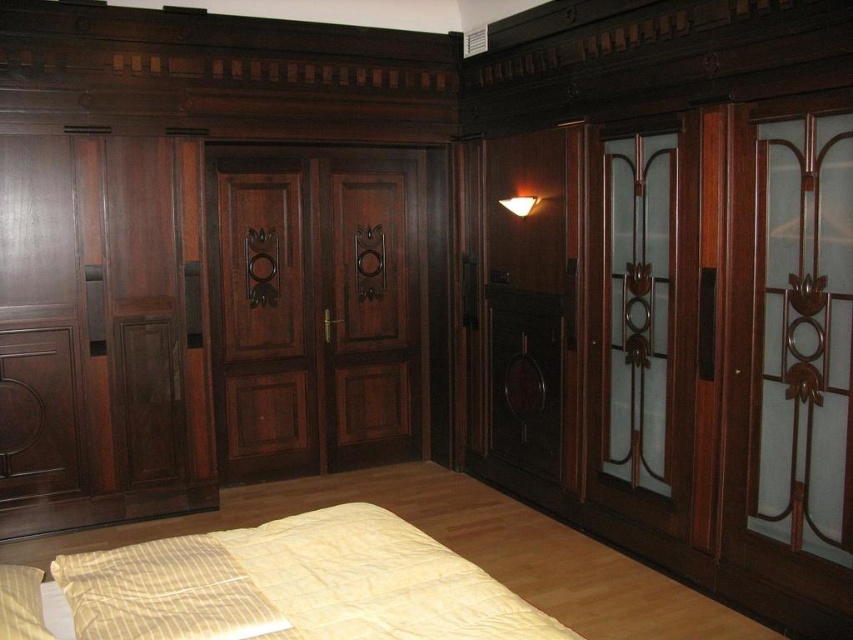
Question: Among these objects, which one is nearest to the camera?

Choices:
 (A) matte dark wood door at center
 (B) matte white wall sconce at upper center

Answer: (B)

Question: Based on their relative distances, which object is farther from the mahogany wood door at right?

Choices:
 (A) yellow fabric pillow at lower left
 (B) yellow striped fabric at lower center

Answer: (A)

Question: Does transparent glass door at right appear over matte white wall sconce at upper center?

Choices:
 (A) no
 (B) yes

Answer: (A)

Question: Does yellow striped fabric at lower center come in front of mahogany wood door at right?

Choices:
 (A) no
 (B) yes

Answer: (B)

Question: Is yellow striped fabric at lower center to the right of matte white wall sconce at upper center from the viewer's perspective?

Choices:
 (A) no
 (B) yes

Answer: (A)

Question: Which of these objects is positioned farthest from the yellow fabric pillow at lower left?

Choices:
 (A) yellow striped pillow at lower left
 (B) transparent glass door at right
 (C) mahogany wood door at right
 (D) matte white wall sconce at upper center

Answer: (D)